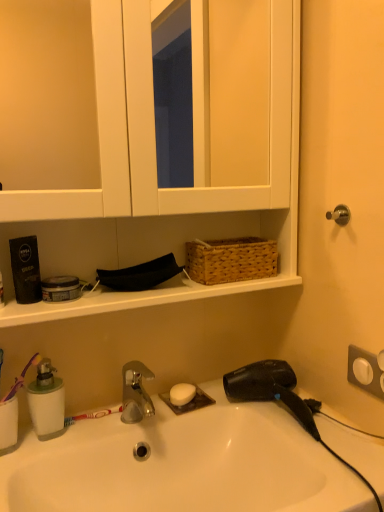
Question: Is purple plastic toothbrush at left in front of white glossy sink at lower center?

Choices:
 (A) no
 (B) yes

Answer: (A)

Question: Is white glossy sink at lower center completely or partially inside purple plastic toothbrush at left?

Choices:
 (A) no
 (B) yes

Answer: (A)

Question: Considering the relative sizes of purple plastic toothbrush at left and white glossy sink at lower center in the image provided, is purple plastic toothbrush at left taller than white glossy sink at lower center?

Choices:
 (A) yes
 (B) no

Answer: (B)

Question: Is purple plastic toothbrush at left in contact with white glossy sink at lower center?

Choices:
 (A) no
 (B) yes

Answer: (A)

Question: Considering the relative sizes of purple plastic toothbrush at left and white glossy sink at lower center in the image provided, is purple plastic toothbrush at left smaller than white glossy sink at lower center?

Choices:
 (A) yes
 (B) no

Answer: (A)

Question: From the image's perspective, does purple plastic toothbrush at left appear lower than white glossy sink at lower center?

Choices:
 (A) no
 (B) yes

Answer: (A)

Question: Considering the relative sizes of white matte soap at center and white matte medicine cabinet at upper center in the image provided, is white matte soap at center taller than white matte medicine cabinet at upper center?

Choices:
 (A) no
 (B) yes

Answer: (A)

Question: Can you confirm if white matte soap at center is bigger than white matte medicine cabinet at upper center?

Choices:
 (A) yes
 (B) no

Answer: (B)

Question: Is white matte soap at center at the left side of white matte medicine cabinet at upper center?

Choices:
 (A) no
 (B) yes

Answer: (A)

Question: Considering the relative positions of white matte soap at center and white matte medicine cabinet at upper center in the image provided, is white matte soap at center to the right of white matte medicine cabinet at upper center from the viewer's perspective?

Choices:
 (A) yes
 (B) no

Answer: (A)

Question: From the image's perspective, is white matte soap at center located beneath white matte medicine cabinet at upper center?

Choices:
 (A) yes
 (B) no

Answer: (A)

Question: Is white matte soap at center directly adjacent to white matte medicine cabinet at upper center?

Choices:
 (A) yes
 (B) no

Answer: (B)

Question: Is the position of white matte medicine cabinet at upper center less distant than that of green translucent soap dispenser at lower left?

Choices:
 (A) yes
 (B) no

Answer: (A)